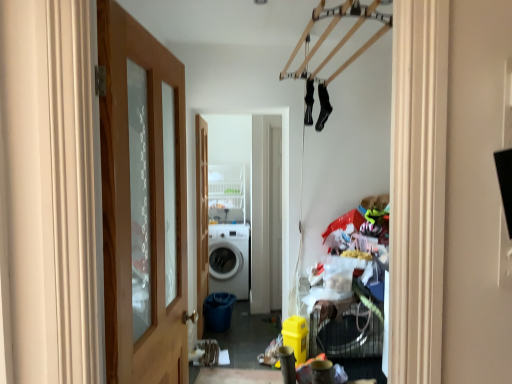
Question: Is white matte washing machine at center outside of wooden door at center, arranged as the 1th door when viewed from the left?

Choices:
 (A) no
 (B) yes

Answer: (B)

Question: Can you confirm if white matte washing machine at center is shorter than wooden door at center, arranged as the 1th door when viewed from the left?

Choices:
 (A) no
 (B) yes

Answer: (B)

Question: Is white matte washing machine at center further to the viewer compared to wooden door at center, the second door in the right-to-left sequence?

Choices:
 (A) no
 (B) yes

Answer: (B)

Question: From a real-world perspective, is white matte washing machine at center over wooden door at center, which is the second door in front-to-back order?

Choices:
 (A) yes
 (B) no

Answer: (B)

Question: Does white matte washing machine at center appear on the right side of wooden door at center, arranged as the 1th door when viewed from the left?

Choices:
 (A) yes
 (B) no

Answer: (A)

Question: From the image's perspective, is wooden door at center, the second door in the right-to-left sequence, located above or below black fabric socks at upper center, which ranks as the 1th clothing in right-to-left order?

Choices:
 (A) above
 (B) below

Answer: (B)

Question: Does point (198, 182) appear closer or farther from the camera than point (318, 87)?

Choices:
 (A) closer
 (B) farther

Answer: (B)

Question: Considering the positions of wooden door at center, acting as the first door starting from the back, and black fabric socks at upper center, which ranks as the 1th clothing in right-to-left order, in the image, is wooden door at center, acting as the first door starting from the back, bigger or smaller than black fabric socks at upper center, which ranks as the 1th clothing in right-to-left order,?

Choices:
 (A) small
 (B) big

Answer: (B)

Question: Relative to black fabric socks at upper center, which ranks as the 1th clothing in right-to-left order, is wooden door at center, arranged as the 1th door when viewed from the left, in front or behind?

Choices:
 (A) front
 (B) behind

Answer: (B)

Question: Relative to wooden door at left, which appears as the first door when viewed from the front, is wooden door at center, the second door in the right-to-left sequence, in front or behind?

Choices:
 (A) behind
 (B) front

Answer: (A)

Question: Is wooden door at center, the second door in the right-to-left sequence, bigger or smaller than wooden door at left, the first door when ordered from right to left?

Choices:
 (A) small
 (B) big

Answer: (B)

Question: Is wooden door at center, which is the second door in front-to-back order, situated inside wooden door at left, acting as the second door starting from the left, or outside?

Choices:
 (A) inside
 (B) outside

Answer: (B)

Question: Visually, is wooden door at center, which is the second door in front-to-back order, positioned to the left or to the right of wooden door at left, which is the 2th door from back to front?

Choices:
 (A) right
 (B) left

Answer: (B)

Question: From a real-world perspective, is black fabric socks at upper center, which is counted as the 2th clothing, starting from the left, physically located above or below white matte washing machine at center?

Choices:
 (A) below
 (B) above

Answer: (B)

Question: Considering the positions of point (320, 110) and point (214, 263), is point (320, 110) closer or farther from the camera than point (214, 263)?

Choices:
 (A) closer
 (B) farther

Answer: (A)